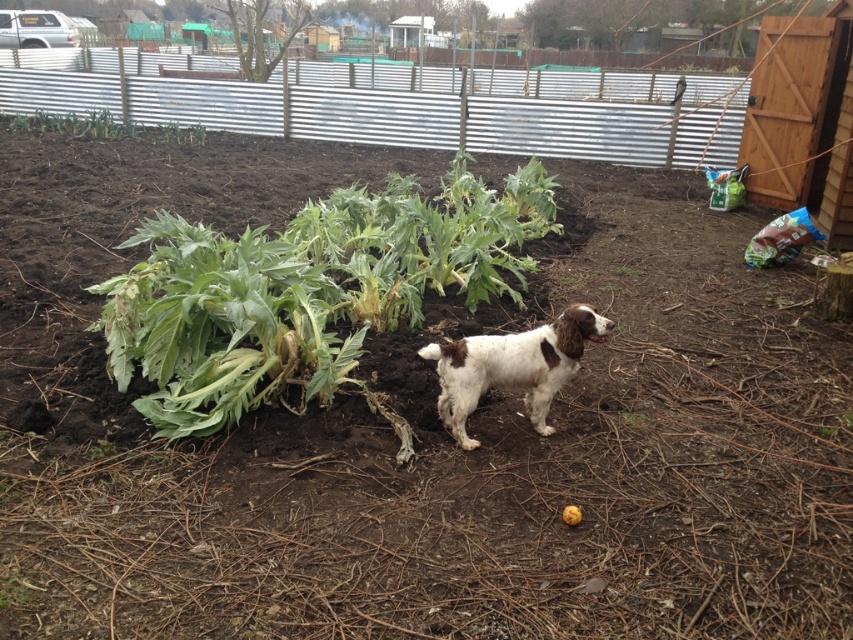
You are a gardener looking at the garden scene. You see the green leafy plant at center and the green leafy plant at upper left. Which one is positioned lower in the image?

The green leafy plant at center is located below the green leafy plant at upper left, so it is positioned lower in the image.

You are a gardener who wants to water the green leafy plant at upper left but your watering can only reaches 30 feet. Is the white fur dog at center in the way of the watering can reaching the plant?

The distance between the white fur dog at center and the green leafy plant at upper left is 33.24 feet, which is beyond the watering can range of 30 feet. Therefore, the dog isn